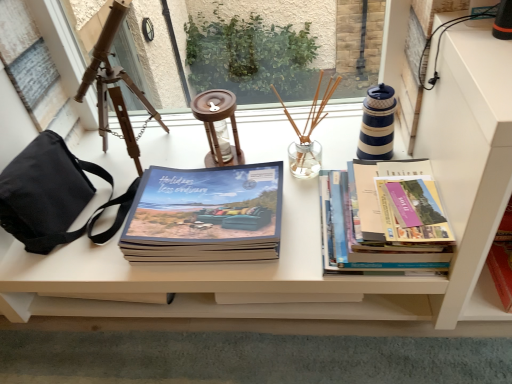
Question: Considering the positions of hardcover books at right, arranged as the 2th book when viewed from the left, and hardcover book at lower right, positioned as the third book in left-to-right order, in the image, is hardcover books at right, arranged as the 2th book when viewed from the left, taller or shorter than hardcover book at lower right, positioned as the third book in left-to-right order,?

Choices:
 (A) short
 (B) tall

Answer: (A)

Question: Considering their positions, is hardcover books at right, arranged as the 2th book when viewed from the left, located in front of or behind hardcover book at lower right, the 1th book when ordered from right to left?

Choices:
 (A) front
 (B) behind

Answer: (A)

Question: Which object is positioned closest to the wooden tripod at left?

Choices:
 (A) black canvas bag at left
 (B) blue and white striped lighthouse at upper right, placed as the third candle holder when sorted from left to right
 (C) clear glass vase at center, the second candle holder when ordered from left to right
 (D) matte blue book at center, placed as the third book when sorted from right to left
 (E) hardcover book at lower right, the 1th book when ordered from right to left

Answer: (A)

Question: Based on their relative distances, which object is nearer to the wooden tripod at left?

Choices:
 (A) hardcover book at lower right, the 1th book when ordered from right to left
 (B) black canvas bag at left
 (C) hardcover books at right, which is counted as the 2th book, starting from the right
 (D) clear glass vase at center, the second candle holder when ordered from left to right
 (E) wooden candle holder at center, which is the 3th candle holder from right to left

Answer: (B)